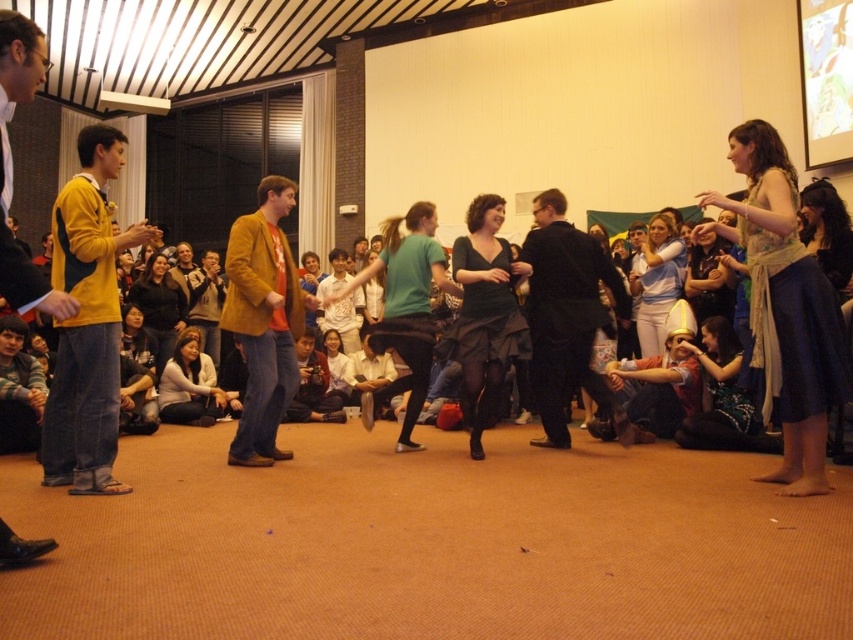
Question: Based on their relative distances, which object is nearer to the white cotton shirt at center?

Choices:
 (A) dark green dress at center
 (B) dark brown leather jacket at lower left
 (C) mustard yellow jacket at center
 (D) light beige sweater at lower left

Answer: (B)

Question: Can you confirm if matte brown jacket at center is wider than white shirt at center?

Choices:
 (A) yes
 (B) no

Answer: (A)

Question: Is black satin dress at center below light beige sweater at lower left?

Choices:
 (A) yes
 (B) no

Answer: (B)

Question: Is dark green dress at center wider than white cotton shirt at center?

Choices:
 (A) yes
 (B) no

Answer: (B)

Question: Which point is closer to the camera taking this photo?

Choices:
 (A) (177, 403)
 (B) (154, 285)

Answer: (A)

Question: Which object is farther from the camera taking this photo?

Choices:
 (A) blue satin dress at right
 (B) white shirt at center
 (C) black satin dress at center
 (D) dark brown hair at upper right

Answer: (B)